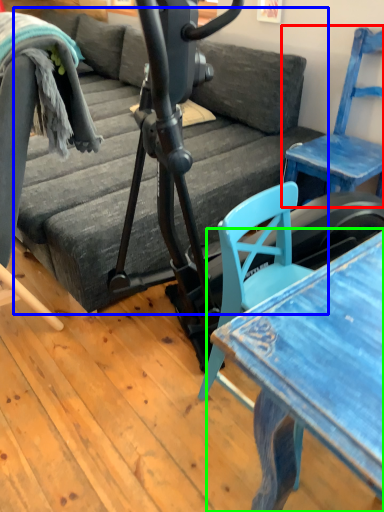
Question: Which object is positioned closest to chair (highlighted by a red box)? Select from studio couch (highlighted by a blue box) and table (highlighted by a green box).

Choices:
 (A) studio couch
 (B) table

Answer: (A)